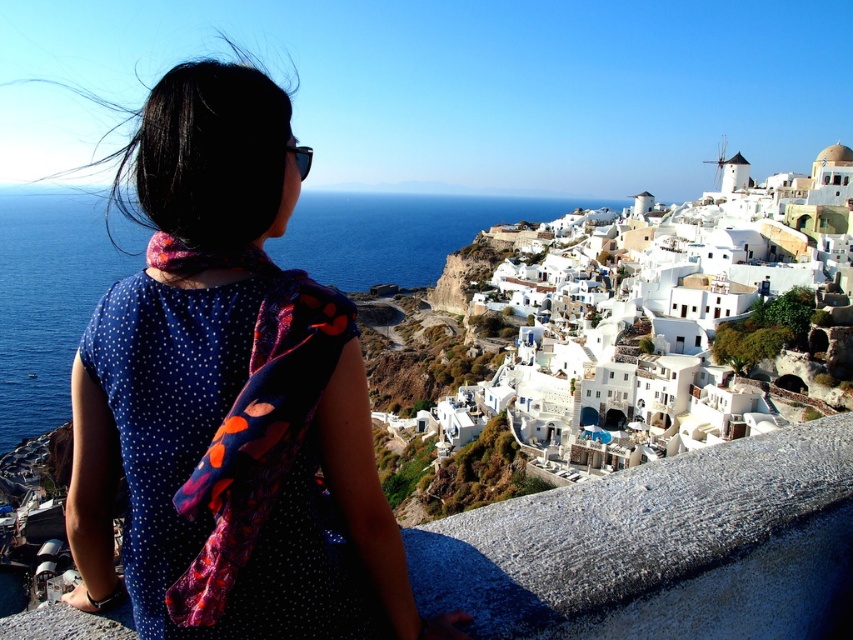
Measure the distance between blue dotted dress at center and camera.

29.08 meters

You are a GUI agent. You are given a task and a screenshot of the screen. Output one action in this format:
    pyautogui.click(x=<x>, y=<y>)
    Task: Click on the blue dotted dress at center
    
    Given the screenshot: What is the action you would take?
    pyautogui.click(x=229, y=397)

Does blue dotted fabric dress at upper left have a lesser width compared to blue water at center?

Yes, blue dotted fabric dress at upper left is thinner than blue water at center.

Consider the image. Which is above, blue dotted fabric dress at upper left or blue water at center?

blue water at center is above.

Which is in front, point (213, 289) or point (421, 225)?

Point (213, 289)

I want to click on blue dotted fabric dress at upper left, so click(x=198, y=461).

Does blue dotted dress at center have a lesser width compared to blue dotted fabric dress at upper left?

Incorrect, blue dotted dress at center's width is not less than blue dotted fabric dress at upper left's.

Which is in front, point (219, 198) or point (189, 561)?

Point (189, 561)

Locate an element on the screen. The image size is (853, 640). blue dotted dress at center is located at coordinates (229, 397).